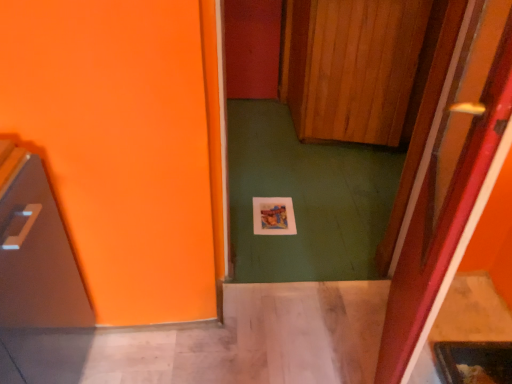
Question: Is wooden at center, the 2th door positioned from the bottom, surrounding wooden at center, the second door in the top-to-bottom sequence?

Choices:
 (A) no
 (B) yes

Answer: (A)

Question: Is wooden at center, the 2th door positioned from the bottom, wider than wooden at center, which is counted as the 1th door, starting from the front?

Choices:
 (A) yes
 (B) no

Answer: (A)

Question: Are wooden at center, the first door viewed from the top, and wooden at center, which is counted as the 1th door, starting from the front, beside each other?

Choices:
 (A) no
 (B) yes

Answer: (A)

Question: Would you say wooden at center, the first door viewed from the top, is a long distance from wooden at center, acting as the 1th door starting from the bottom?

Choices:
 (A) no
 (B) yes

Answer: (B)

Question: Is wooden at center, the 2th door positioned from the bottom, to the right of wooden at center, acting as the 1th door starting from the bottom, from the viewer's perspective?

Choices:
 (A) no
 (B) yes

Answer: (B)

Question: Visually, is shiny metallic microwave at left positioned to the left or to the right of wooden at center, acting as the 1th door starting from the bottom?

Choices:
 (A) left
 (B) right

Answer: (A)

Question: In the image, is shiny metallic microwave at left positioned in front of or behind wooden at center, the second door in the top-to-bottom sequence?

Choices:
 (A) behind
 (B) front

Answer: (A)

Question: From a real-world perspective, relative to wooden at center, acting as the 1th door starting from the bottom, is shiny metallic microwave at left vertically above or below?

Choices:
 (A) above
 (B) below

Answer: (B)

Question: From the image's perspective, is shiny metallic microwave at left positioned above or below wooden at center, the second door in the top-to-bottom sequence?

Choices:
 (A) above
 (B) below

Answer: (B)

Question: Is point (440, 137) closer or farther from the camera than point (14, 276)?

Choices:
 (A) farther
 (B) closer

Answer: (A)

Question: Is wooden at center, the second door when ordered from back to front, inside the boundaries of shiny metallic microwave at left, or outside?

Choices:
 (A) outside
 (B) inside

Answer: (A)

Question: From a real-world perspective, is wooden at center, the second door when ordered from back to front, above or below shiny metallic microwave at left?

Choices:
 (A) below
 (B) above

Answer: (B)

Question: In terms of height, does wooden at center, which is counted as the 1th door, starting from the front, look taller or shorter compared to shiny metallic microwave at left?

Choices:
 (A) short
 (B) tall

Answer: (B)

Question: From their relative heights in the image, would you say shiny metallic microwave at left is taller or shorter than wooden at center, the first door viewed from the top?

Choices:
 (A) short
 (B) tall

Answer: (A)

Question: Is point 37,339 positioned closer to the camera than point 408,4?

Choices:
 (A) farther
 (B) closer

Answer: (B)